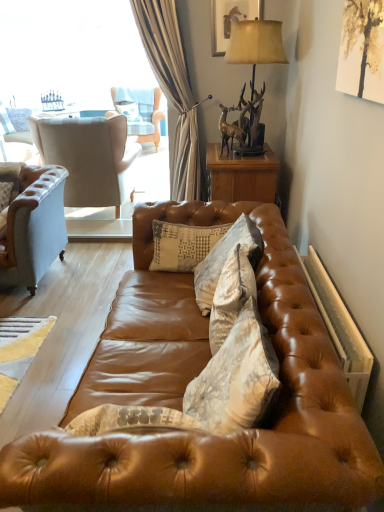
Locate an element on the screen. This screenshot has width=384, height=512. free space in front of metallic gold deer at upper right is located at coordinates (232, 162).